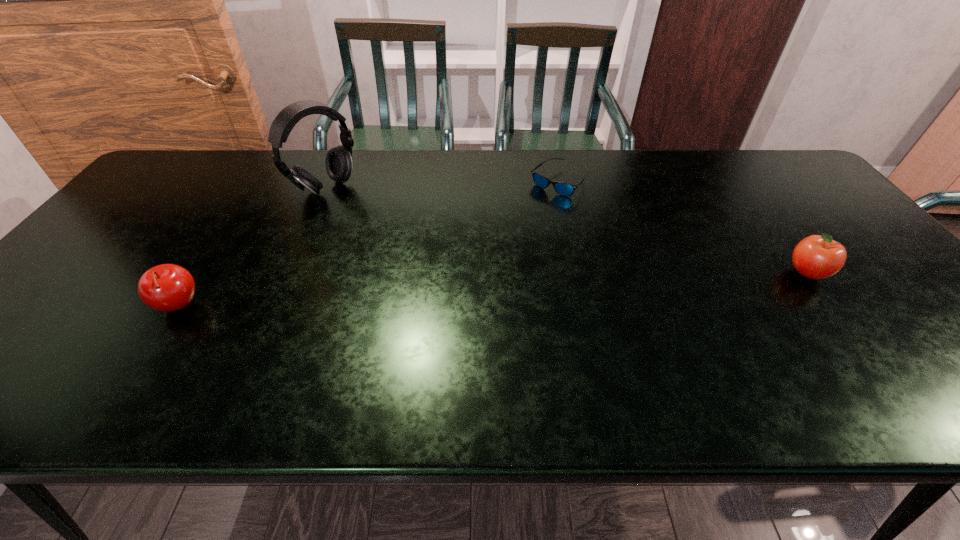
This screenshot has height=540, width=960. Find the location of `vacant area situated 0.330m at the front of the sunglasses showing the lenses`. vacant area situated 0.330m at the front of the sunglasses showing the lenses is located at coordinates (582, 278).

This screenshot has width=960, height=540. Identify the location of blank space located on the ear cups of the earphone. (439, 264).

The height and width of the screenshot is (540, 960). I want to click on vacant space located on the ear cups of the earphone, so click(x=383, y=227).

Locate an element on the screen. blank area located 0.310m on the ear cups of the earphone is located at coordinates (415, 248).

Find the location of `sunglasses at the far edge`. sunglasses at the far edge is located at coordinates (565, 189).

Identify the location of earphone positioned at the far edge. (338, 162).

This screenshot has width=960, height=540. In the image, there is a desktop. What are the coordinates of `vacant space at the far edge` in the screenshot? It's located at (643, 155).

The width and height of the screenshot is (960, 540). In order to click on vacant region at the near edge of the desktop in this screenshot , I will do `click(489, 336)`.

The width and height of the screenshot is (960, 540). Identify the location of blank area at the left edge. [x=183, y=204].

Locate an element on the screen. This screenshot has height=540, width=960. free space at the right edge is located at coordinates (868, 262).